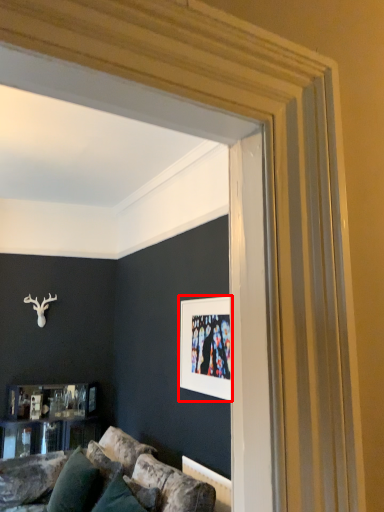
Question: In this image, where is picture frame (annotated by the red box) located relative to pillow?

Choices:
 (A) left
 (B) right

Answer: (B)